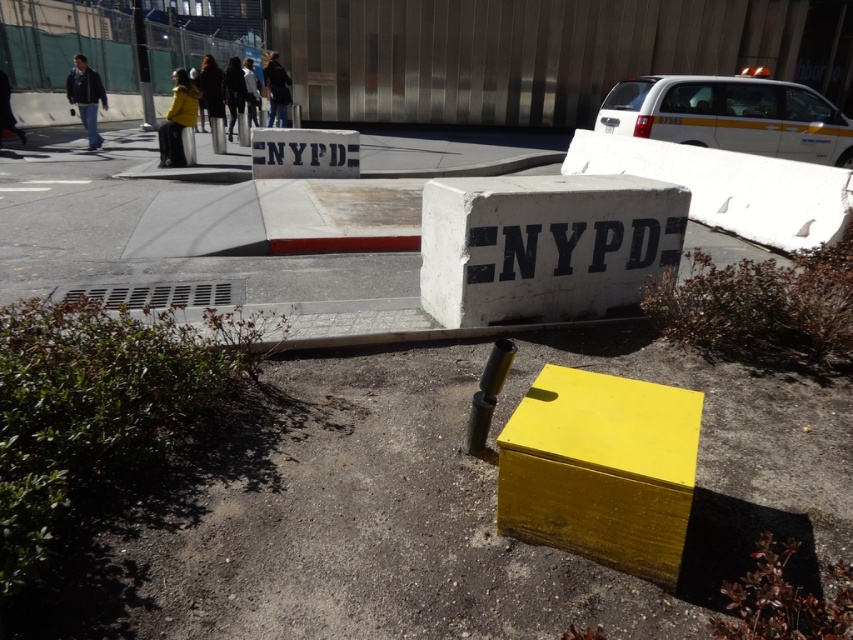
Is dark blue jacket at upper left to the right of dark blue jacket at upper center from the viewer's perspective?

Incorrect, dark blue jacket at upper left is not on the right side of dark blue jacket at upper center.

Does dark blue jacket at upper left lie behind dark blue jacket at upper center?

No, it is not.

I want to click on dark blue jacket at upper left, so click(x=86, y=97).

Is point (167, 157) positioned in front of point (277, 72)?

Yes.

Is point (189, 92) positioned after point (270, 83)?

No, it is not.

What do you see at coordinates (177, 120) in the screenshot? I see `yellow matte jacket at upper left` at bounding box center [177, 120].

Image resolution: width=853 pixels, height=640 pixels. In order to click on yellow matte jacket at upper left in this screenshot , I will do `click(177, 120)`.

Who is more forward, (x=700, y=401) or (x=250, y=120)?

Point (x=700, y=401) is in front.

Who is more distant from viewer, (x=556, y=516) or (x=252, y=76)?

The point (x=252, y=76) is more distant.

Identify the location of yellow matte box at center. This screenshot has height=640, width=853. (x=601, y=468).